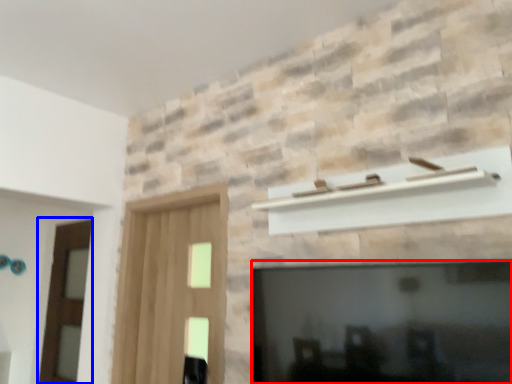
Question: Which object is further to the camera taking this photo, fireplace (highlighted by a red box) or screen door (highlighted by a blue box)?

Choices:
 (A) fireplace
 (B) screen door

Answer: (B)